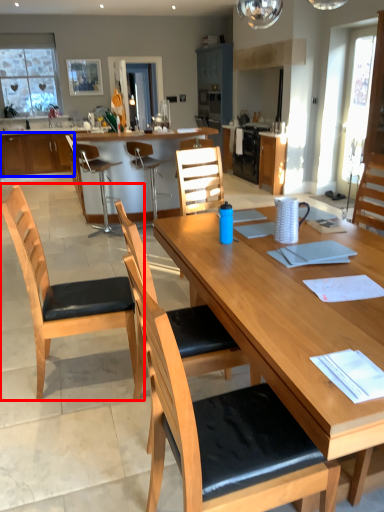
Question: Which object appears farthest to the camera in this image, chair (highlighted by a red box) or cabinetry (highlighted by a blue box)?

Choices:
 (A) chair
 (B) cabinetry

Answer: (B)